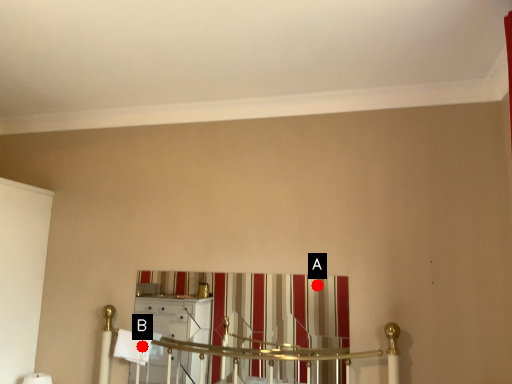
Question: Two points are circled on the image, labeled by A and B beside each circle. Which point appears farthest from the camera in this image?

Choices:
 (A) A is further
 (B) B is further

Answer: (B)